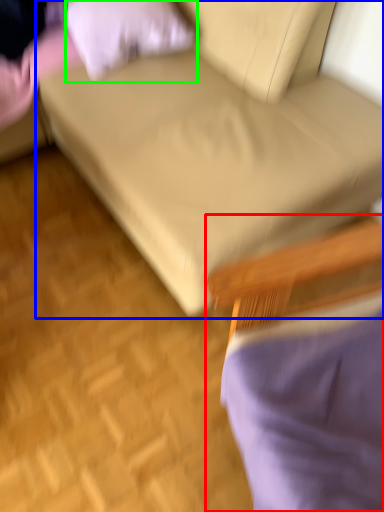
Question: Considering the real-world distances, which object is closest to chair (highlighted by a red box)? studio couch (highlighted by a blue box) or pillow (highlighted by a green box).

Choices:
 (A) studio couch
 (B) pillow

Answer: (A)